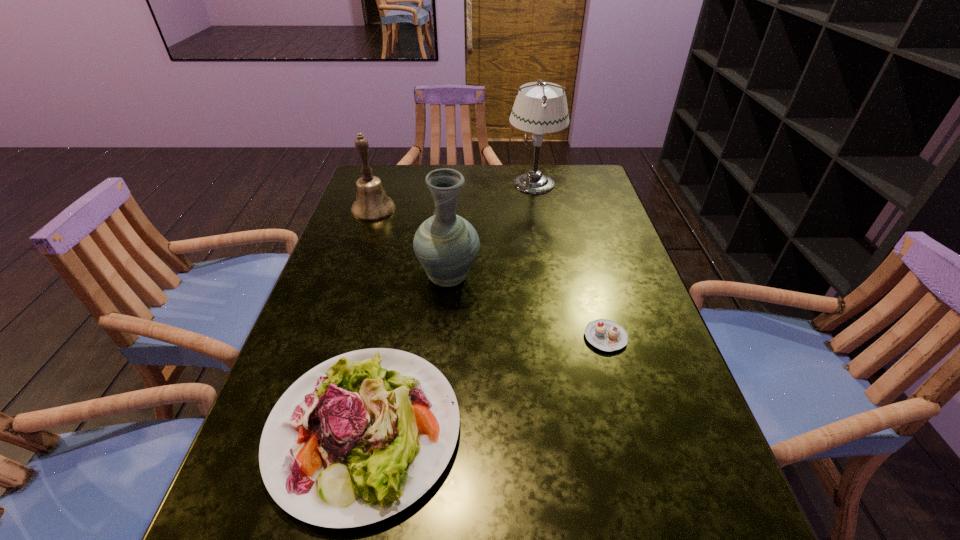
The image size is (960, 540). Identify the location of lampshade. (543, 109).

The height and width of the screenshot is (540, 960). Identify the location of the third nearest object. (446, 245).

In order to click on bell in this screenshot , I will do `click(372, 204)`.

Where is `the fourth nearest object`? the fourth nearest object is located at coordinates (372, 204).

The width and height of the screenshot is (960, 540). Find the location of `salad plate`. salad plate is located at coordinates (358, 438).

Find the location of `the nearest object`. the nearest object is located at coordinates (358, 438).

In order to click on the fourth farthest object in this screenshot , I will do `click(604, 334)`.

Where is `cupcake`? The width and height of the screenshot is (960, 540). cupcake is located at coordinates (604, 334).

This screenshot has width=960, height=540. Identify the location of vacant space positioned on the lampshade of the farthest object. (420, 183).

At what (x,y) coordinates should I click in order to perform the action: click on free spot located 0.240m on the lampshade of the farthest object. Please return your answer as a coordinate pair (x, y). The width and height of the screenshot is (960, 540). Looking at the image, I should click on (432, 183).